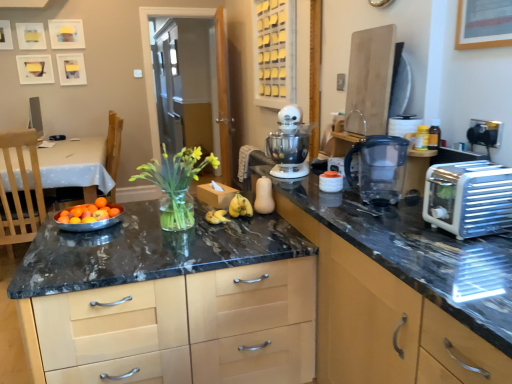
Locate an element on the screen. The height and width of the screenshot is (384, 512). free space to the right of yellow matte bananas at center is located at coordinates (270, 220).